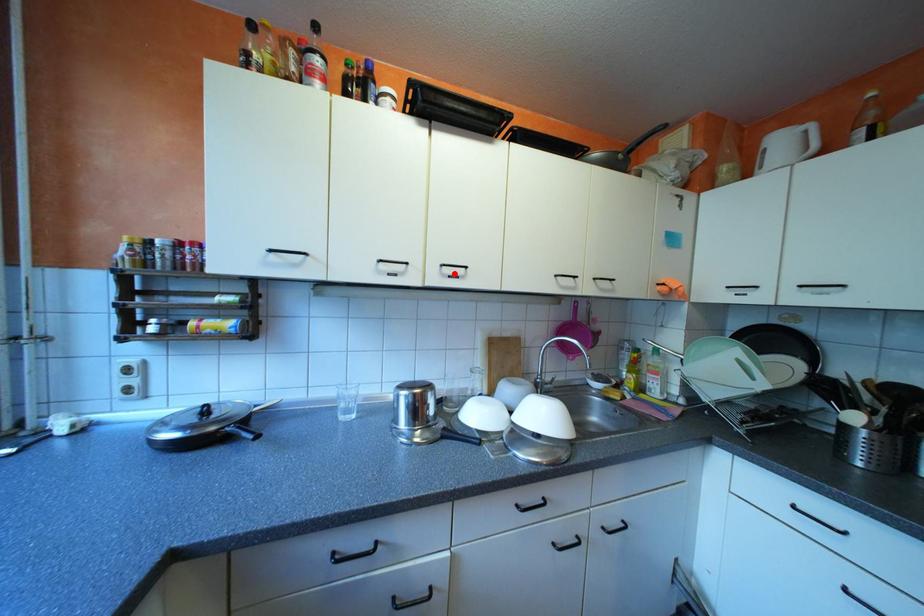
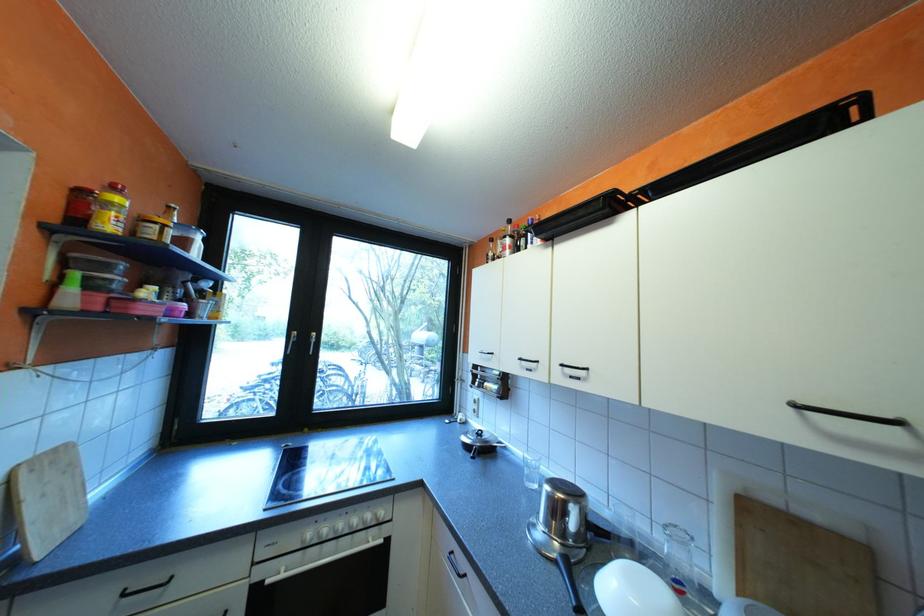
In the second image, find the point that corresponds to the highlighted location in the first image.

(576, 373)